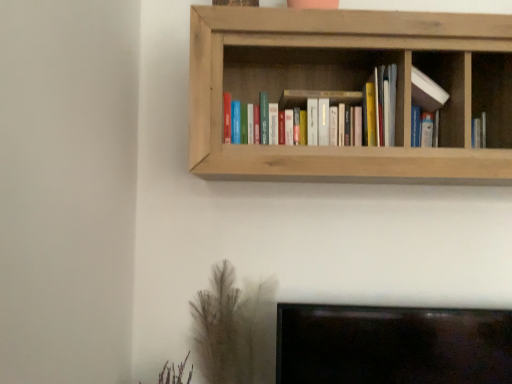
Question: In terms of size, does brown textured plant at lower left appear bigger or smaller than matte wooden bookshelf at center?

Choices:
 (A) big
 (B) small

Answer: (B)

Question: Is brown textured plant at lower left in front of or behind matte wooden bookshelf at center in the image?

Choices:
 (A) front
 (B) behind

Answer: (B)

Question: Which of these objects is positioned closest to the natural wood bookshelf at upper center?

Choices:
 (A) matte wooden bookshelf at center
 (B) brown textured plant at lower left
 (C) white matte bookshelf at upper center

Answer: (A)

Question: Which object is the farthest from the brown textured plant at lower left?

Choices:
 (A) matte wooden bookshelf at center
 (B) white matte bookshelf at upper center
 (C) natural wood bookshelf at upper center

Answer: (B)